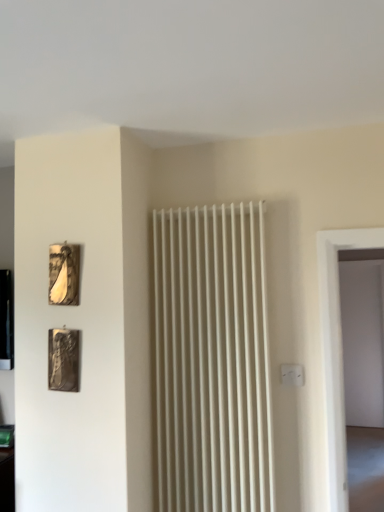
Question: Does metallic silver picture frame at lower left, which is counted as the 1th picture frame, starting from the bottom, have a greater width compared to metallic gold picture frame at upper left, placed as the 1th picture frame when sorted from top to bottom?

Choices:
 (A) yes
 (B) no

Answer: (A)

Question: Is metallic silver picture frame at lower left, which is counted as the 1th picture frame, starting from the bottom, directly adjacent to metallic gold picture frame at upper left, placed as the 1th picture frame when sorted from top to bottom?

Choices:
 (A) no
 (B) yes

Answer: (A)

Question: From a real-world perspective, is metallic silver picture frame at lower left, which is counted as the 1th picture frame, starting from the bottom, on metallic gold picture frame at upper left, arranged as the 2th picture frame when ordered from the bottom?

Choices:
 (A) no
 (B) yes

Answer: (A)

Question: Can you confirm if metallic silver picture frame at lower left, the second picture frame viewed from the top, is thinner than metallic gold picture frame at upper left, placed as the 1th picture frame when sorted from top to bottom?

Choices:
 (A) yes
 (B) no

Answer: (B)

Question: Is the position of metallic silver picture frame at lower left, the second picture frame viewed from the top, more distant than that of metallic gold picture frame at upper left, placed as the 1th picture frame when sorted from top to bottom?

Choices:
 (A) yes
 (B) no

Answer: (B)

Question: Does point (296, 377) appear closer or farther from the camera than point (76, 254)?

Choices:
 (A) farther
 (B) closer

Answer: (A)

Question: From the image's perspective, is white plastic electric outlet at center-right located above or below metallic gold picture frame at upper left, placed as the 1th picture frame when sorted from top to bottom?

Choices:
 (A) below
 (B) above

Answer: (A)

Question: From a real-world perspective, is white plastic electric outlet at center-right positioned above or below metallic gold picture frame at upper left, placed as the 1th picture frame when sorted from top to bottom?

Choices:
 (A) below
 (B) above

Answer: (A)

Question: Considering the positions of white plastic electric outlet at center-right and metallic gold picture frame at upper left, arranged as the 2th picture frame when ordered from the bottom, in the image, is white plastic electric outlet at center-right bigger or smaller than metallic gold picture frame at upper left, arranged as the 2th picture frame when ordered from the bottom,?

Choices:
 (A) big
 (B) small

Answer: (B)

Question: Is point (59, 385) closer or farther from the camera than point (302, 371)?

Choices:
 (A) farther
 (B) closer

Answer: (B)

Question: Is metallic silver picture frame at lower left, the second picture frame viewed from the top, spatially inside white plastic electric outlet at center-right, or outside of it?

Choices:
 (A) outside
 (B) inside

Answer: (A)

Question: Is metallic silver picture frame at lower left, the second picture frame viewed from the top, wider or thinner than white plastic electric outlet at center-right?

Choices:
 (A) thin
 (B) wide

Answer: (B)

Question: Based on their sizes in the image, would you say metallic silver picture frame at lower left, the second picture frame viewed from the top, is bigger or smaller than white plastic electric outlet at center-right?

Choices:
 (A) small
 (B) big

Answer: (B)

Question: Considering the positions of metallic gold picture frame at upper left, placed as the 1th picture frame when sorted from top to bottom, and metallic silver picture frame at lower left, which is counted as the 1th picture frame, starting from the bottom, in the image, is metallic gold picture frame at upper left, placed as the 1th picture frame when sorted from top to bottom, taller or shorter than metallic silver picture frame at lower left, which is counted as the 1th picture frame, starting from the bottom,?

Choices:
 (A) tall
 (B) short

Answer: (B)

Question: Based on their positions, is metallic gold picture frame at upper left, placed as the 1th picture frame when sorted from top to bottom, located to the left or right of metallic silver picture frame at lower left, the second picture frame viewed from the top?

Choices:
 (A) left
 (B) right

Answer: (A)